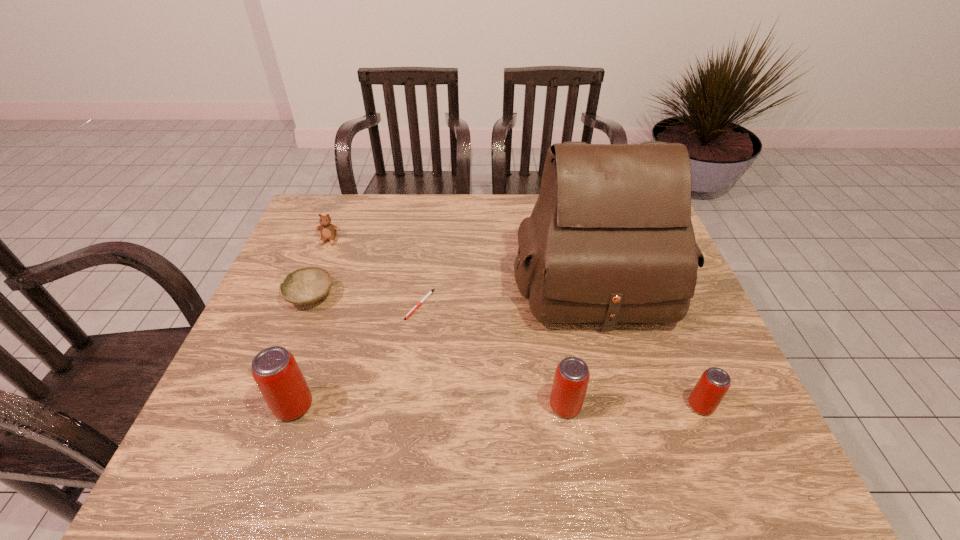
Find the location of a particular element. The width and height of the screenshot is (960, 540). pen is located at coordinates (431, 291).

I want to click on vacant space located on the right of the leftmost beer can, so click(450, 406).

At what (x,y) coordinates should I click in order to perform the action: click on vacant area located on the back of the second beer can from left to right. Please return your answer as a coordinate pair (x, y). The width and height of the screenshot is (960, 540). Looking at the image, I should click on (556, 346).

Locate an element on the screen. The image size is (960, 540). vacant area situated 0.280m on the back of the fourth shortest object is located at coordinates (660, 304).

Find the location of a particular element. free spot located on the front-facing side of the third shortest object is located at coordinates (305, 299).

What are the coordinates of `vacant space located 0.060m on the front flap of the tallest object` in the screenshot? It's located at (613, 356).

Find the location of `vacant space situated on the back of the bowl`. vacant space situated on the back of the bowl is located at coordinates (336, 231).

Locate an element on the screen. vacant space located on the clicker of the shortest object is located at coordinates (416, 339).

This screenshot has height=540, width=960. I want to click on object situated at the far edge, so click(x=328, y=231).

You are a GUI agent. You are given a task and a screenshot of the screen. Output one action in this format:
    pyautogui.click(x=<x>, y=<y>)
    Task: Click on the beer can situated at the left edge
    
    Given the screenshot: What is the action you would take?
    pyautogui.click(x=275, y=370)